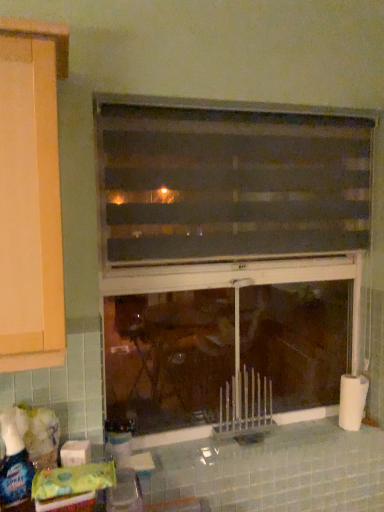
Question: Is translucent plastic bottle at lower left, acting as the 1th bottle starting from the right, thinner than translucent plastic spray bottle at lower left, the first bottle in the front-to-back sequence?

Choices:
 (A) no
 (B) yes

Answer: (A)

Question: From a real-world perspective, is translucent plastic bottle at lower left, the 2th bottle viewed from the front, positioned over translucent plastic spray bottle at lower left, which is the first bottle in left-to-right order, based on gravity?

Choices:
 (A) no
 (B) yes

Answer: (A)

Question: Is translucent plastic bottle at lower left, arranged as the second bottle when viewed from the left, to the left of translucent plastic spray bottle at lower left, the first bottle in the front-to-back sequence, from the viewer's perspective?

Choices:
 (A) no
 (B) yes

Answer: (A)

Question: Is translucent plastic bottle at lower left, arranged as the second bottle when viewed from the left, looking in the opposite direction of translucent plastic spray bottle at lower left, which is the first bottle in left-to-right order?

Choices:
 (A) yes
 (B) no

Answer: (B)

Question: Does translucent plastic bottle at lower left, the 2th bottle viewed from the front, have a lesser height compared to translucent plastic spray bottle at lower left, which appears as the 2th bottle when viewed from the right?

Choices:
 (A) yes
 (B) no

Answer: (A)

Question: Considering the relative sizes of translucent plastic bottle at lower left, the first bottle viewed from the back, and translucent plastic spray bottle at lower left, which is counted as the second bottle, starting from the back, in the image provided, is translucent plastic bottle at lower left, the first bottle viewed from the back, taller than translucent plastic spray bottle at lower left, which is counted as the second bottle, starting from the back,?

Choices:
 (A) no
 (B) yes

Answer: (A)

Question: From a real-world perspective, is white matte toilet paper at right, the 2th toilet paper in the left-to-right sequence, positioned under translucent plastic bottle at lower left, acting as the 1th bottle starting from the right, based on gravity?

Choices:
 (A) no
 (B) yes

Answer: (A)

Question: Considering the relative sizes of white matte toilet paper at right, the 2th toilet paper in the left-to-right sequence, and translucent plastic bottle at lower left, the 2th bottle viewed from the front, in the image provided, is white matte toilet paper at right, the 2th toilet paper in the left-to-right sequence, taller than translucent plastic bottle at lower left, the 2th bottle viewed from the front,?

Choices:
 (A) yes
 (B) no

Answer: (A)

Question: Can you confirm if white matte toilet paper at right, the first toilet paper when ordered from back to front, is positioned to the left of translucent plastic bottle at lower left, arranged as the second bottle when viewed from the left?

Choices:
 (A) yes
 (B) no

Answer: (B)

Question: From a real-world perspective, does white matte toilet paper at right, the 2th toilet paper in the left-to-right sequence, stand above translucent plastic bottle at lower left, arranged as the second bottle when viewed from the left?

Choices:
 (A) no
 (B) yes

Answer: (B)

Question: Can you see white matte toilet paper at right, which is counted as the 2th toilet paper, starting from the front, touching translucent plastic bottle at lower left, arranged as the second bottle when viewed from the left?

Choices:
 (A) no
 (B) yes

Answer: (A)

Question: Is white matte toilet paper at right, the 2th toilet paper in the left-to-right sequence, turned away from translucent plastic bottle at lower left, arranged as the second bottle when viewed from the left?

Choices:
 (A) no
 (B) yes

Answer: (A)

Question: Is white matte toilet paper at lower left, positioned as the 1th toilet paper in front-to-back order, positioned behind translucent plastic bottle at lower left, the first bottle viewed from the back?

Choices:
 (A) no
 (B) yes

Answer: (A)